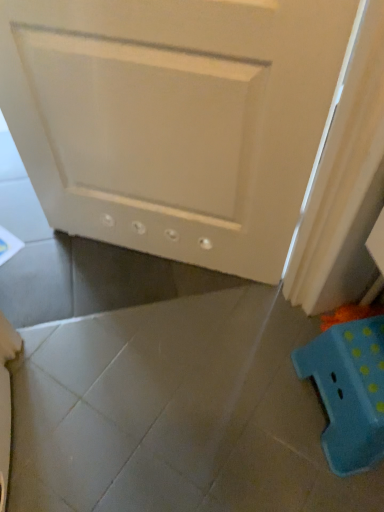
The height and width of the screenshot is (512, 384). What are the coordinates of `blue rubber step stool at lower right` in the screenshot? It's located at (349, 391).

The width and height of the screenshot is (384, 512). What do you see at coordinates (349, 391) in the screenshot? I see `blue rubber step stool at lower right` at bounding box center [349, 391].

What is the approximate width of blue rubber step stool at lower right?

12.24 inches.

Find the location of a particular element. The height and width of the screenshot is (512, 384). blue rubber step stool at lower right is located at coordinates (349, 391).